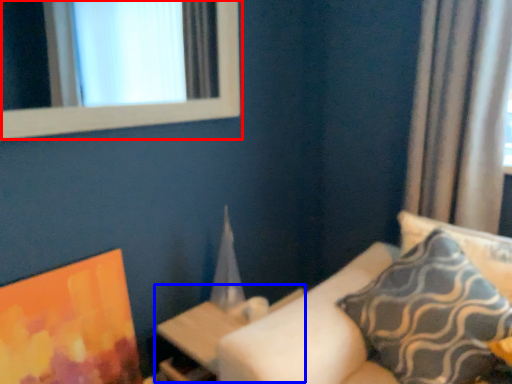
Question: Among these objects, which one is nearest to the camera, window (highlighted by a red box) or table (highlighted by a blue box)?

Choices:
 (A) window
 (B) table

Answer: (A)